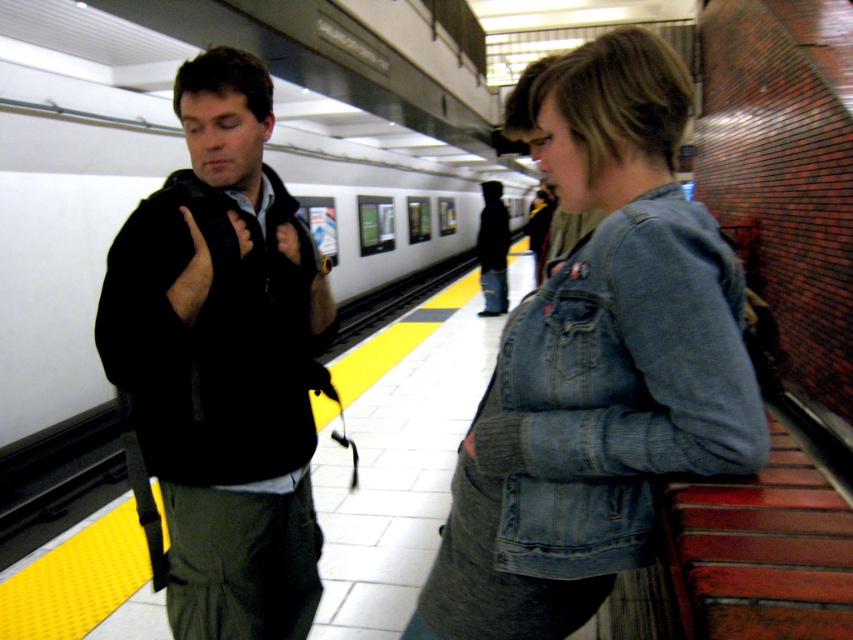
Is black softshell jacket at left wider than faded denim jacket at lower right?

No.

How distant is black softshell jacket at left from faded denim jacket at lower right?

black softshell jacket at left is 27.29 inches away from faded denim jacket at lower right.

Does point (207, 65) come closer to viewer compared to point (567, 278)?

That is False.

The height and width of the screenshot is (640, 853). What are the coordinates of `black softshell jacket at left` in the screenshot? It's located at (223, 362).